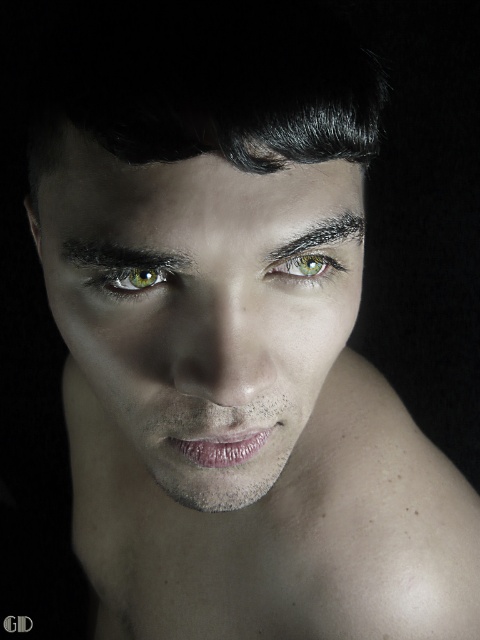
Based on the photo, you are an artist analyzing a portrait. You notice the smooth skin at lower center and the green matte eye at center. Which object is wider?

The smooth skin at lower center is wider than the green matte eye at center.

You have a small sticker that is 1.5 inches wide. You want to place it between the smooth skin face at center and the green matte eye at upper center. Can you fit it without overlapping either object?

The distance between the smooth skin face at center and the green matte eye at upper center is 2.06 inches. Since the sticker is 1.5 inches wide, it can fit between them without overlapping as 1.5 is less than 2.06.